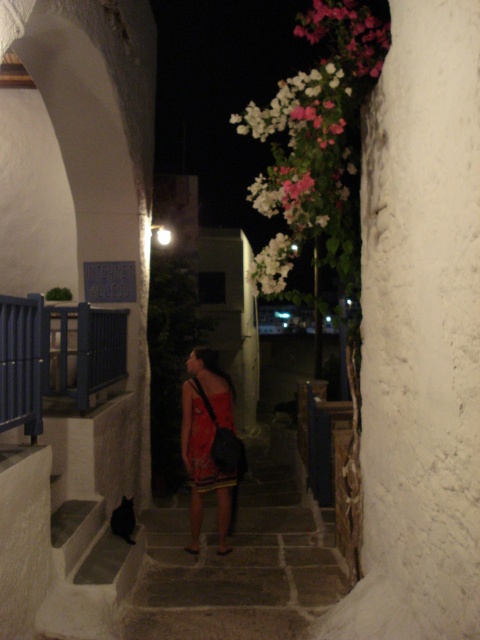
You are a fashion designer observing the two dresses displayed in the alleyway. Which dress is taller, the matte red dress at center or the red satin dress at center?

The matte red dress at center is taller than the red satin dress at center according to the description.

In the scene shown: You are standing in the middle of the alleyway and notice a point marked at coordinates (421,324). Based on the scene description, what object is located at this point?

The point at coordinates (421,324) marks the location of the white rough textured pillar at center right.

You are standing at the entrance of the alleyway and see the dark gray stone stairs at center and the matte red dress at center. Which object is closer to you?

The dark gray stone stairs at center is closer to you than the matte red dress at center.